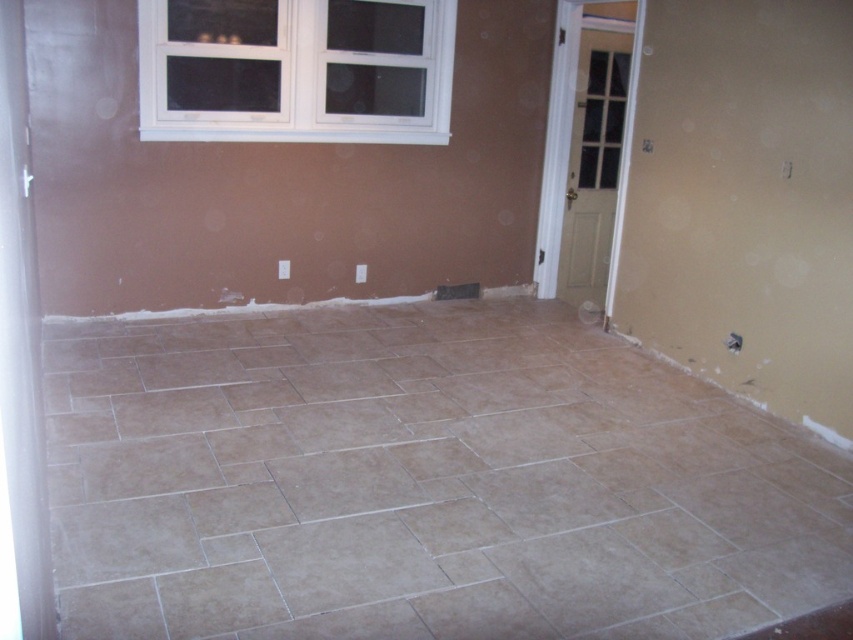
You are a contractor measuring the sizes of objects in the room. You see the beige tile at center and the white plastic window at upper center. Which object has a larger size?

The beige tile at center is bigger than the white plastic window at upper center.

You are a contractor measuring the dimensions of the room. You need to install a new fixture that requires knowing which object is wider between the beige tile at center and the white plastic window at upper center. Which one is wider?

The beige tile at center is wider than the white plastic window at upper center according to the description provided.

You are a contractor standing in the center of the room. You need to measure the distance from your current position to both point [215,364] and point [416,84]. Which point is closer to you?

Point [215,364] is closer to the camera than point [416,84], so the contractor would be closer to point [215,364].